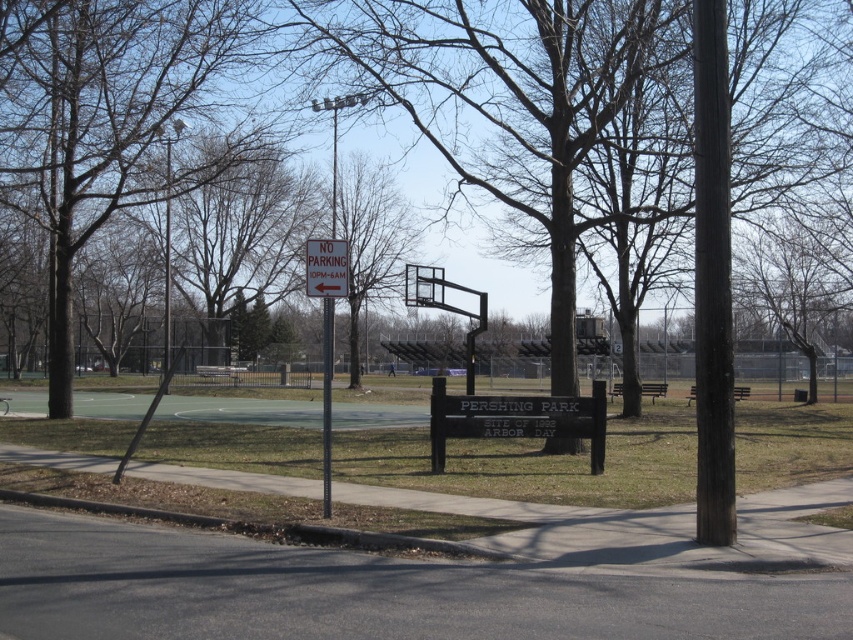
You are standing in the park and want to take a photo of the brown bark tree at center and the black metal basketball hoop at center. If you want the tree to appear to the right side of the basketball hoop in your photo, which direction should you move relative to the basketball hoop?

You should move to the left side of the black metal basketball hoop at center because the brown bark tree at center is already positioned to the left of the black metal basketball hoop at center. By moving left, the tree will shift to the right side in your photo.

You are standing at the entrance of the park and want to locate the brown bark tree at center. According to the coordinates provided, where should you look relative to your current position?

The brown bark tree at center is located at coordinates point (370, 241), which means it is positioned slightly to the left and forward from your current position at the park entrance.

You are a park visitor who wants to take a photo of the brown bark tree at center and the black metal basketball hoop at center. Which object should you stand closer to in order to capture both in a single frame without zooming?

You should stand closer to the black metal basketball hoop at center because it is shorter than the brown bark tree at center, allowing both to fit within the frame when positioned closer to the smaller object.